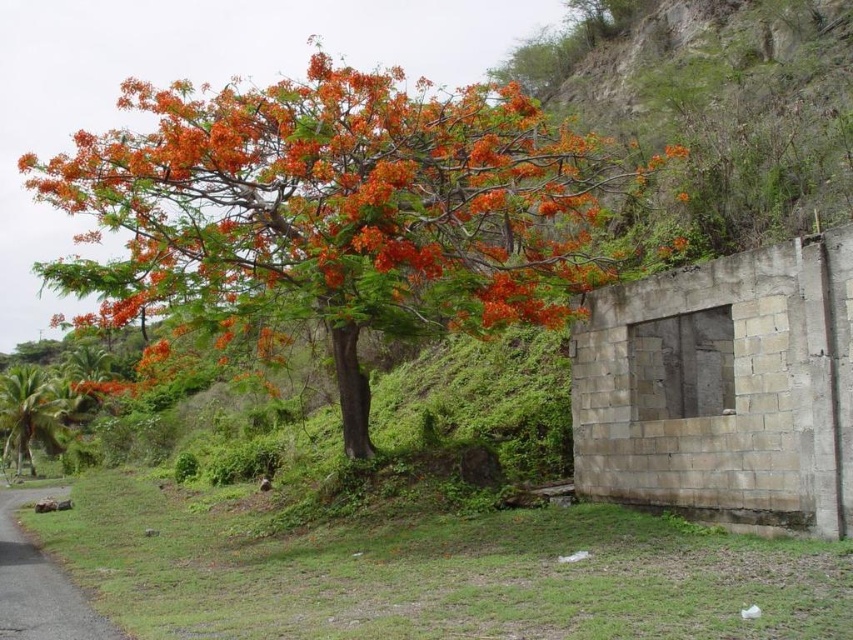
Question: Is orange leafy tree at center thinner than green leafy palm at lower left?

Choices:
 (A) no
 (B) yes

Answer: (A)

Question: Can you confirm if orange leafy tree at center is smaller than green leafy palm at lower left?

Choices:
 (A) yes
 (B) no

Answer: (B)

Question: Does orange leafy tree at center have a smaller size compared to green leafy palm at lower left?

Choices:
 (A) no
 (B) yes

Answer: (A)

Question: Which point appears farthest from the camera in this image?

Choices:
 (A) (106, 196)
 (B) (4, 371)

Answer: (B)